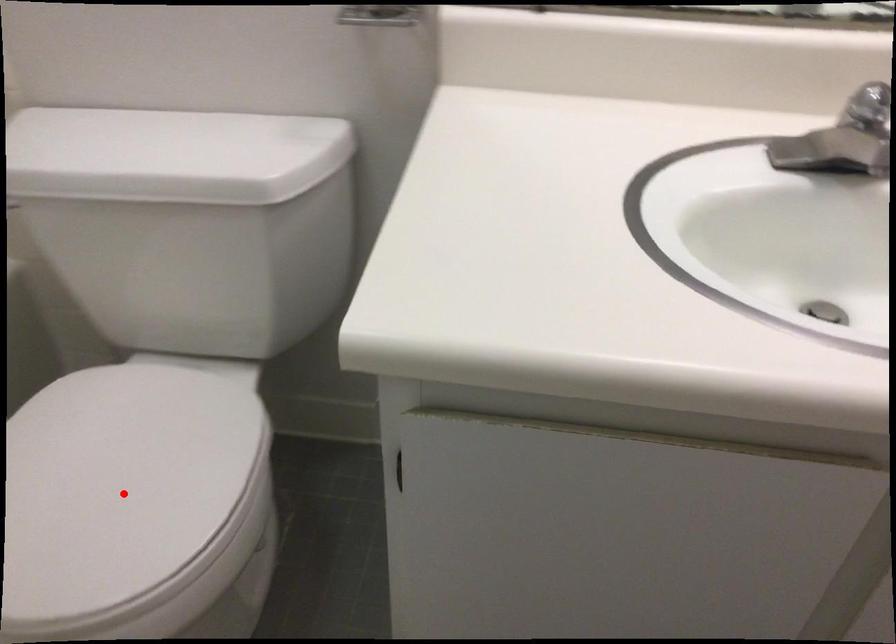
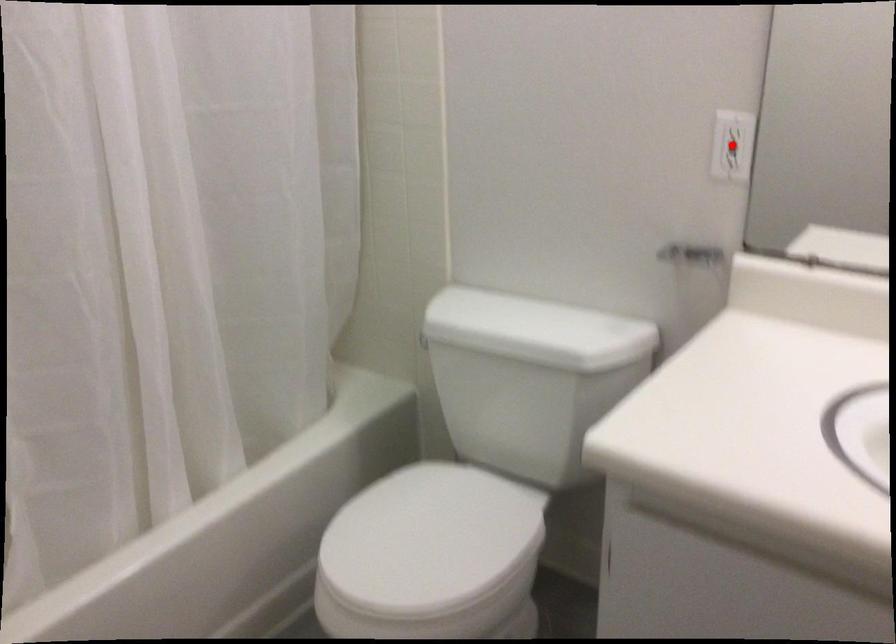
I am providing you with two images of the same scene from different viewpoints. A red point is marked on the first image and another point is marked on the second image. Is the marked point in image1 the same physical position as the marked point in image2?

No